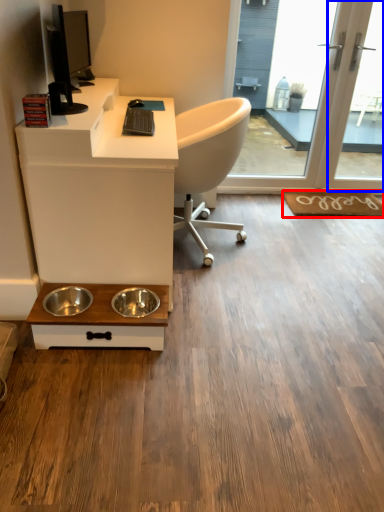
Question: Which of the following is the farthest to the observer, doormat (highlighted by a red box) or screen door (highlighted by a blue box)?

Choices:
 (A) doormat
 (B) screen door

Answer: (A)